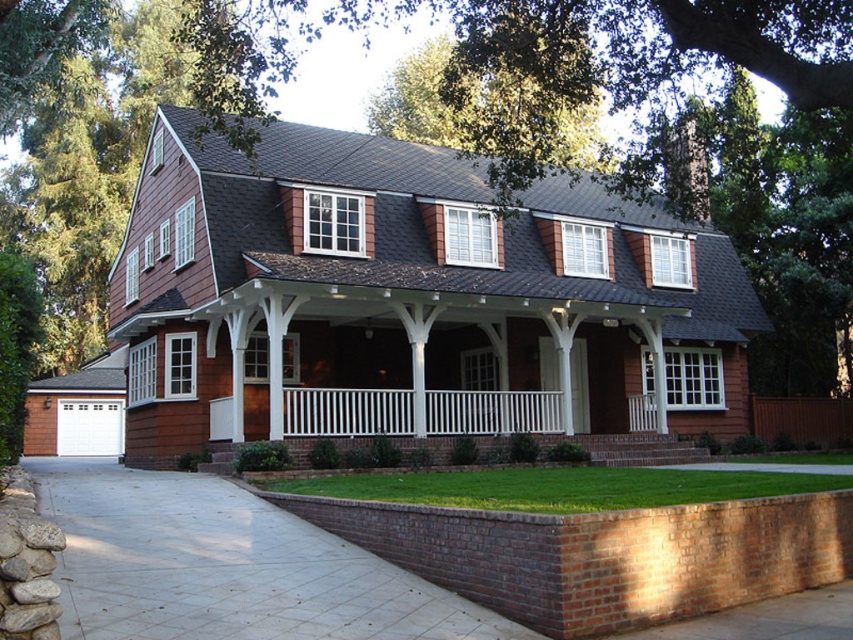
You are standing at the front door of the house. Looking down, you notice a specific point marked at coordinates point (x=225, y=566). What is the location of this point relative to the house?

The point (x=225, y=566) marks the gray concrete driveway at lower left.

You are planning to park your car on the gray concrete driveway at lower left. However, you also see the white painted wood porch at center. Which of these two areas is longer in length?

The gray concrete driveway at lower left is shorter than the white painted wood porch at center, so the white painted wood porch at center is longer.